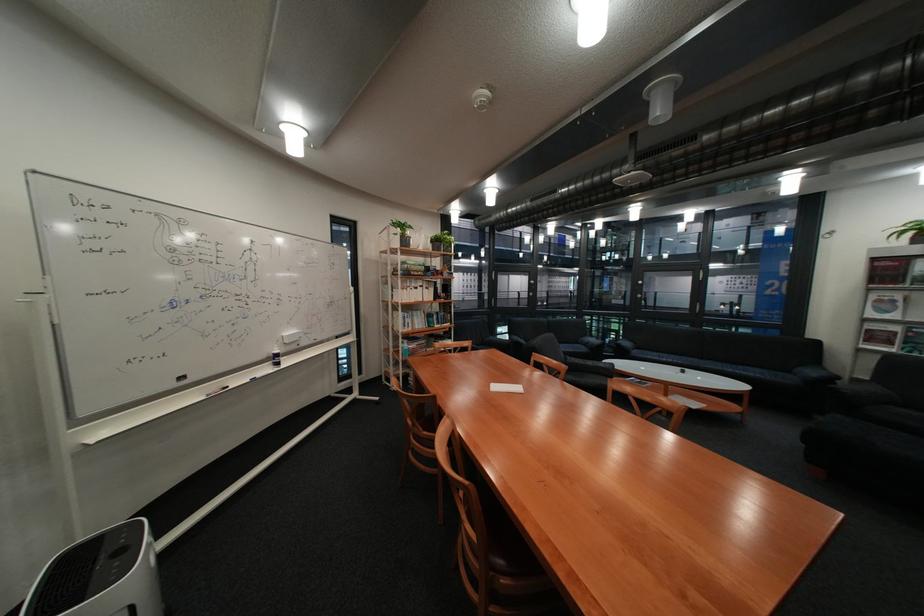
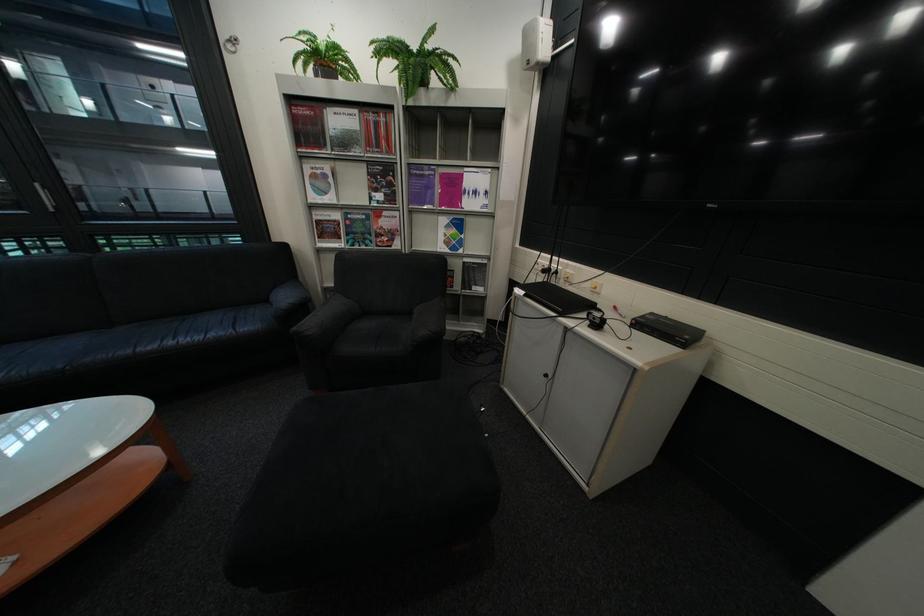
The point at (767, 374) is marked in the first image. Where is the corresponding point in the second image?

(213, 338)